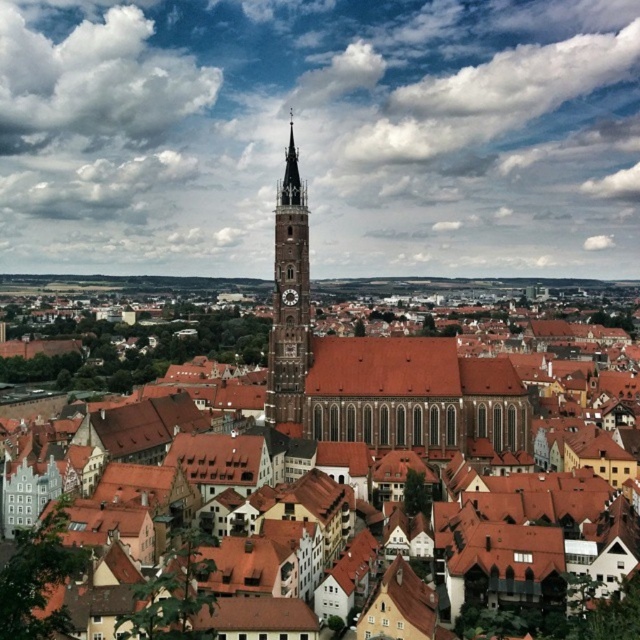
You are standing in the historic city square and want to take a photo of both the brown tiled roof at center and the brown stone clock tower at center. Which object should you focus on first to ensure both are in clear view?

You should focus on the brown tiled roof at center first since it is closer to the viewer than the brown stone clock tower at center, ensuring both are in clear view when focused properly.

You are an architect visiting the historic city. You notice the brown stone clock tower at center and the dark brown wooden clock at center. Which of these two objects is bigger in size?

The brown stone clock tower at center is larger in size than the dark brown wooden clock at center.